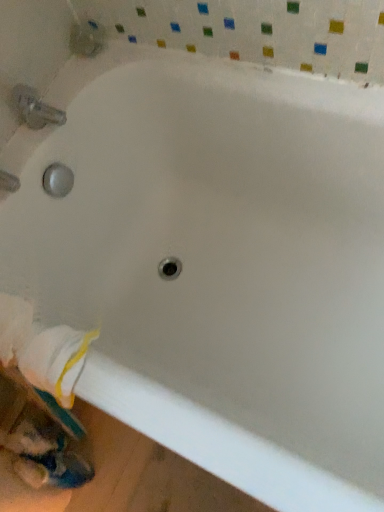
Where is `vacant position to the left of matte silver faucet at upper left`? vacant position to the left of matte silver faucet at upper left is located at coordinates (19, 144).